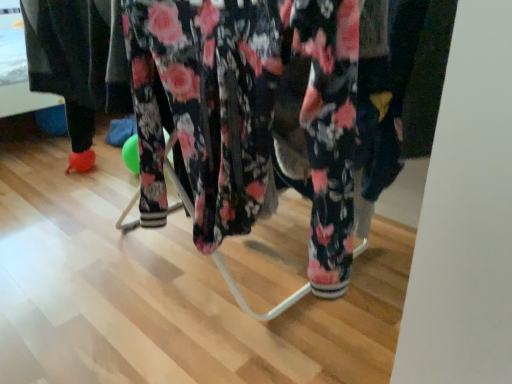
Where is `vacant space underneath floral fabric pants at center (from a real-world perspective)`? The width and height of the screenshot is (512, 384). vacant space underneath floral fabric pants at center (from a real-world perspective) is located at coordinates (175, 291).